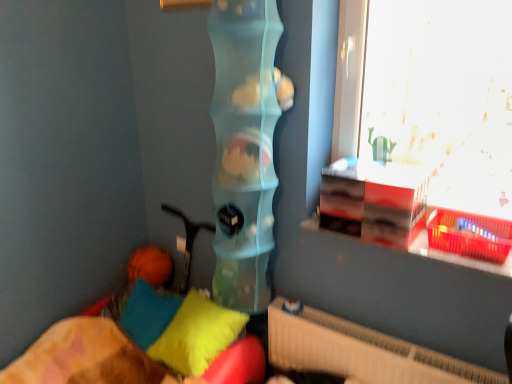
Question: Could you tell me if soft plush pillow at lower left, arranged as the 2th pillow when viewed from the left, is facing soft fabric pillows at lower left?

Choices:
 (A) yes
 (B) no

Answer: (B)

Question: Considering the relative sizes of soft plush pillow at lower left, arranged as the 2th pillow when viewed from the left, and soft fabric pillows at lower left in the image provided, is soft plush pillow at lower left, arranged as the 2th pillow when viewed from the left, smaller than soft fabric pillows at lower left?

Choices:
 (A) no
 (B) yes

Answer: (B)

Question: From the image's perspective, is soft plush pillow at lower left, arranged as the 2th pillow when viewed from the left, located beneath soft fabric pillows at lower left?

Choices:
 (A) yes
 (B) no

Answer: (B)

Question: Considering the relative positions of soft plush pillow at lower left, arranged as the 2th pillow when viewed from the left, and soft fabric pillows at lower left in the image provided, is soft plush pillow at lower left, arranged as the 2th pillow when viewed from the left, behind soft fabric pillows at lower left?

Choices:
 (A) yes
 (B) no

Answer: (A)

Question: Is there a large distance between soft plush pillow at lower left, which is counted as the 1th pillow, starting from the right, and soft fabric pillows at lower left?

Choices:
 (A) no
 (B) yes

Answer: (A)

Question: Can we say soft plush pillow at lower left, arranged as the 2th pillow when viewed from the left, lies outside soft fabric pillows at lower left?

Choices:
 (A) yes
 (B) no

Answer: (B)

Question: Would you say white textured radiator at lower right contains soft cotton pillow at lower left, which is the first pillow in left-to-right order?

Choices:
 (A) yes
 (B) no

Answer: (B)

Question: Considering the relative sizes of white textured radiator at lower right and soft cotton pillow at lower left, which is the first pillow in left-to-right order, in the image provided, is white textured radiator at lower right taller than soft cotton pillow at lower left, which is the first pillow in left-to-right order,?

Choices:
 (A) yes
 (B) no

Answer: (A)

Question: Is the depth of white textured radiator at lower right less than that of soft cotton pillow at lower left, which is the first pillow in left-to-right order?

Choices:
 (A) yes
 (B) no

Answer: (A)

Question: Is white textured radiator at lower right oriented away from soft cotton pillow at lower left, which is the first pillow in left-to-right order?

Choices:
 (A) yes
 (B) no

Answer: (B)

Question: From the image's perspective, is white textured radiator at lower right on top of soft cotton pillow at lower left, which is the first pillow in left-to-right order?

Choices:
 (A) yes
 (B) no

Answer: (B)

Question: Is white textured radiator at lower right bigger than soft cotton pillow at lower left, the 2th pillow in the right-to-left sequence?

Choices:
 (A) no
 (B) yes

Answer: (B)

Question: Does soft cotton pillow at lower left, the 2th pillow in the right-to-left sequence, have a smaller size compared to soft fabric pillows at lower left?

Choices:
 (A) no
 (B) yes

Answer: (B)